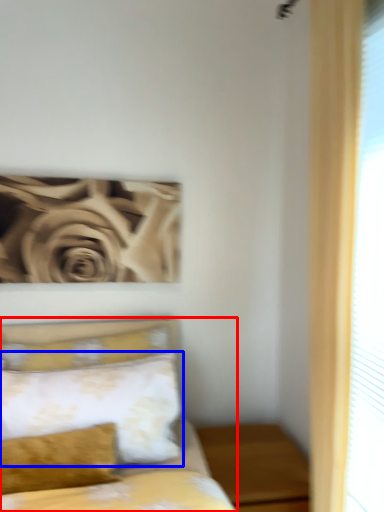
Question: Among these objects, which one is farthest to the camera, bed (highlighted by a red box) or pillow (highlighted by a blue box)?

Choices:
 (A) bed
 (B) pillow

Answer: (B)